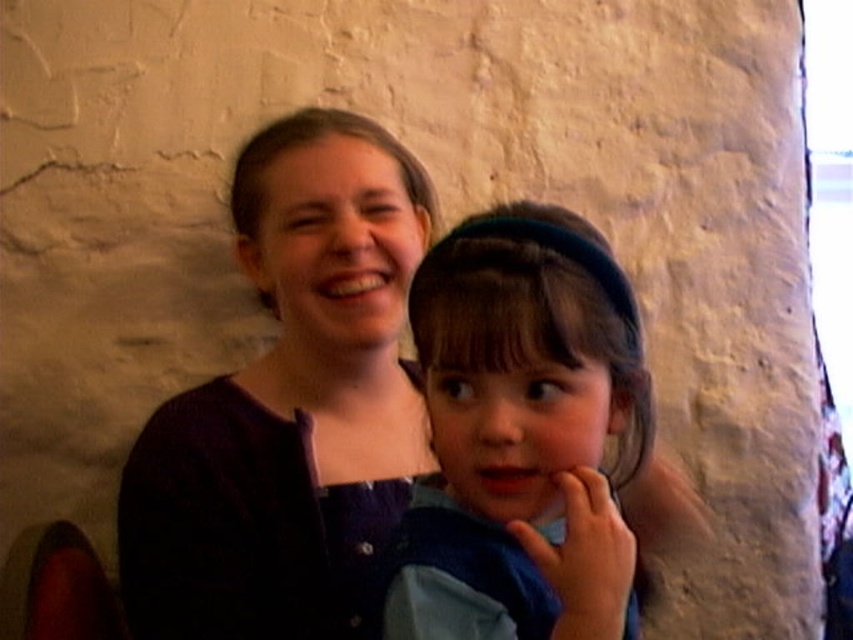
Is point (318, 589) positioned after point (573, 307)?

Yes, it is behind point (573, 307).

Based on the photo, does matte purple sweater at center appear on the left side of blue fabric at center?

Correct, you'll find matte purple sweater at center to the left of blue fabric at center.

Between point (273, 144) and point (490, 272), which one is positioned in front?

Positioned in front is point (490, 272).

Image resolution: width=853 pixels, height=640 pixels. In order to click on matte purple sweater at center in this screenshot , I will do `click(289, 403)`.